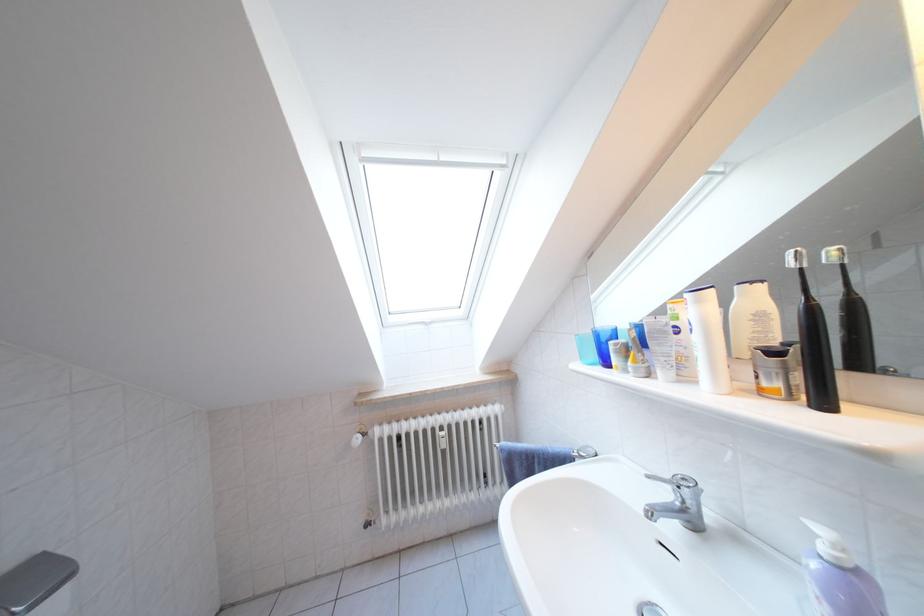
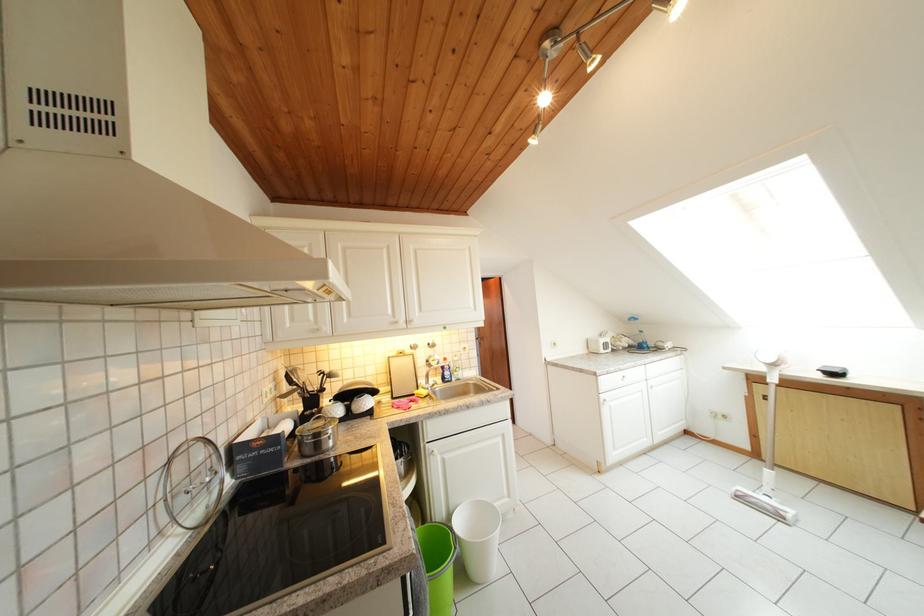
Question: I am providing you with two images of the same scene from different viewpoints. Which of the following objects are not visible in image2?

Choices:
 (A) vacuum cleaner handle
 (B) silver deodorant can
 (C) silver cabinet knob
 (D) pencil holder

Answer: (B)